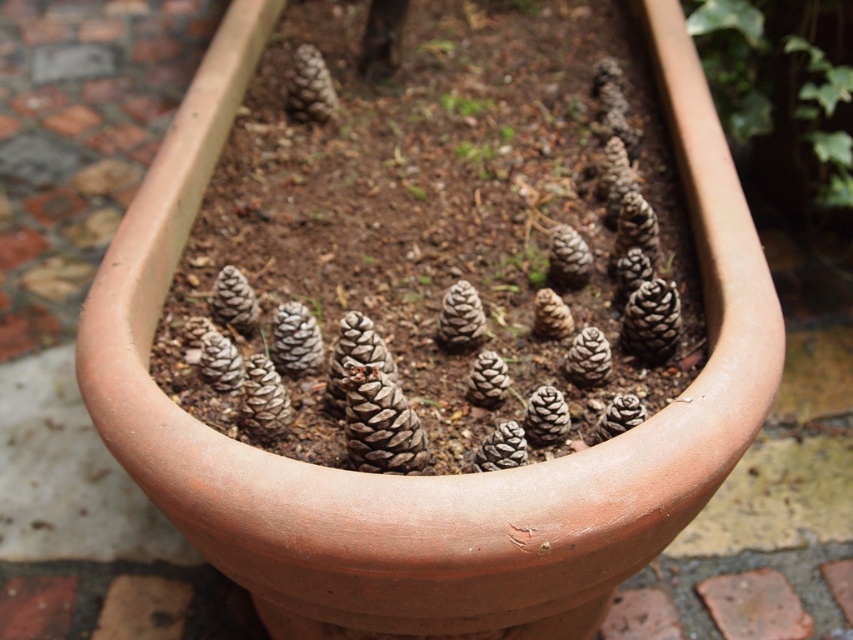
Question: Among these points, which one is farthest from the camera?

Choices:
 (A) (476, 108)
 (B) (761, 51)

Answer: (B)

Question: Is green matte ivy at upper right smaller than green fuzzy plant at center?

Choices:
 (A) no
 (B) yes

Answer: (A)

Question: Which point is farther from the camera taking this photo?

Choices:
 (A) (788, 108)
 (B) (469, 113)

Answer: (A)

Question: Is green matte ivy at upper right smaller than green fuzzy plant at center?

Choices:
 (A) no
 (B) yes

Answer: (A)

Question: Is green matte ivy at upper right wider than green fuzzy plant at center?

Choices:
 (A) yes
 (B) no

Answer: (A)